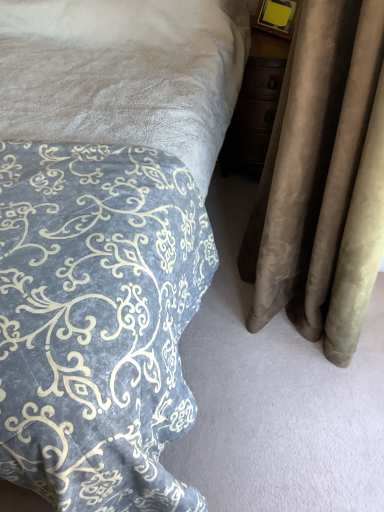
Question: Which is correct: velvet-patterned bedspread at lower left is inside suede curtain at right, or outside of it?

Choices:
 (A) inside
 (B) outside

Answer: (B)

Question: Considering the positions of velvet-patterned bedspread at lower left and suede curtain at right in the image, is velvet-patterned bedspread at lower left taller or shorter than suede curtain at right?

Choices:
 (A) tall
 (B) short

Answer: (A)

Question: Based on their sizes in the image, would you say velvet-patterned bedspread at lower left is bigger or smaller than suede curtain at right?

Choices:
 (A) small
 (B) big

Answer: (B)

Question: In the image, is suede curtain at right positioned in front of or behind velvet-patterned bedspread at lower left?

Choices:
 (A) behind
 (B) front

Answer: (A)

Question: In terms of width, does suede curtain at right look wider or thinner when compared to velvet-patterned bedspread at lower left?

Choices:
 (A) wide
 (B) thin

Answer: (B)

Question: Is suede curtain at right inside or outside of velvet-patterned bedspread at lower left?

Choices:
 (A) inside
 (B) outside

Answer: (B)

Question: Considering the positions of point (322, 221) and point (77, 394), is point (322, 221) closer or farther from the camera than point (77, 394)?

Choices:
 (A) farther
 (B) closer

Answer: (A)